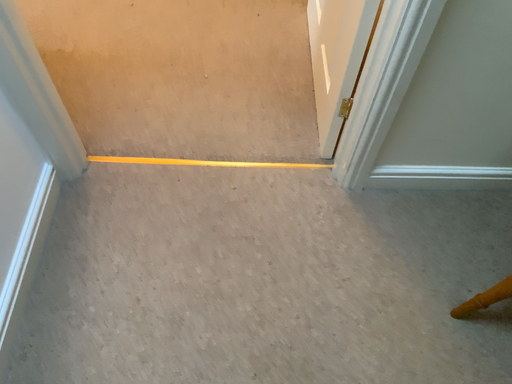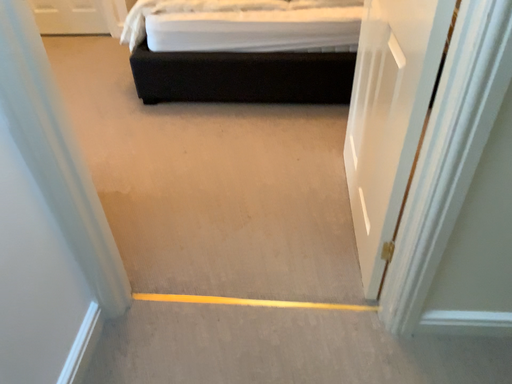
Question: How did the camera likely rotate when shooting the video?

Choices:
 (A) rotated downward
 (B) rotated upward

Answer: (B)